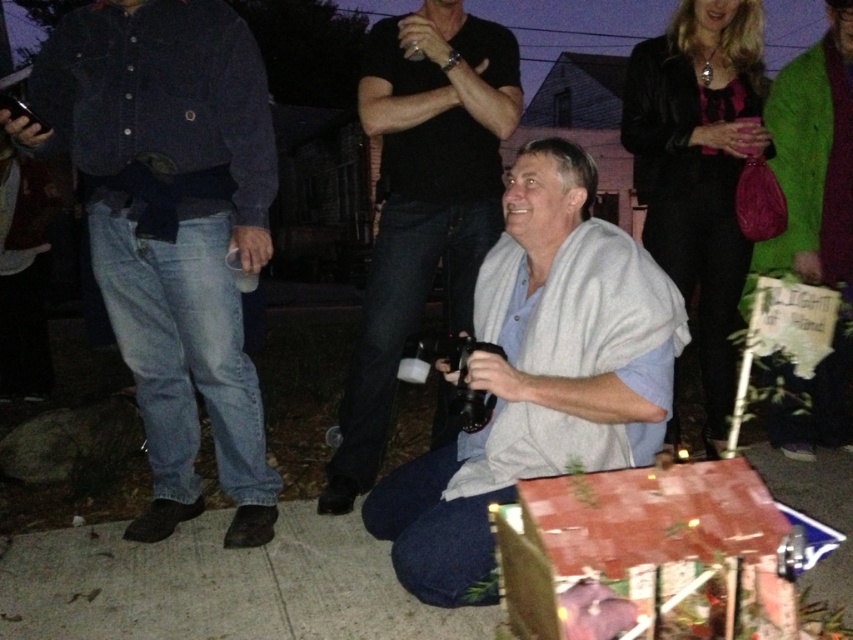
Question: Among these points, which one is farthest from the camera?

Choices:
 (A) (259, 513)
 (B) (833, 202)
 (C) (635, 276)

Answer: (B)

Question: Which point appears closest to the camera in this image?

Choices:
 (A) click(x=393, y=336)
 (B) click(x=161, y=532)
 (C) click(x=692, y=81)
 (D) click(x=495, y=298)

Answer: (D)

Question: In this image, where is velvet black robe at right located relative to green fuzzy robe at upper right?

Choices:
 (A) above
 (B) below

Answer: (A)

Question: Which point is farther to the camera?

Choices:
 (A) (749, 280)
 (B) (189, 182)
 (C) (651, 83)
 (D) (457, 572)

Answer: (C)

Question: Is matte black camera at center thinner than green fuzzy robe at upper right?

Choices:
 (A) yes
 (B) no

Answer: (A)

Question: Does matte black camera at center have a greater width compared to velvet black robe at right?

Choices:
 (A) no
 (B) yes

Answer: (B)